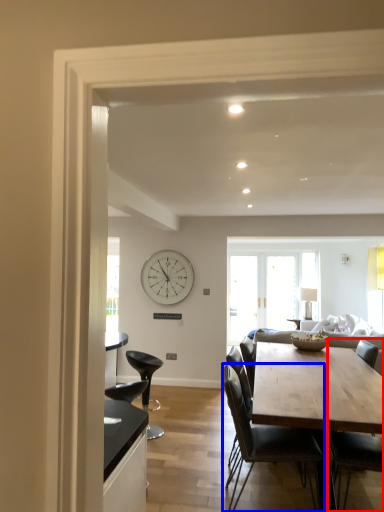
Question: Which point is further to the camera, chair (highlighted by a red box) or chair (highlighted by a blue box)?

Choices:
 (A) chair
 (B) chair

Answer: (B)